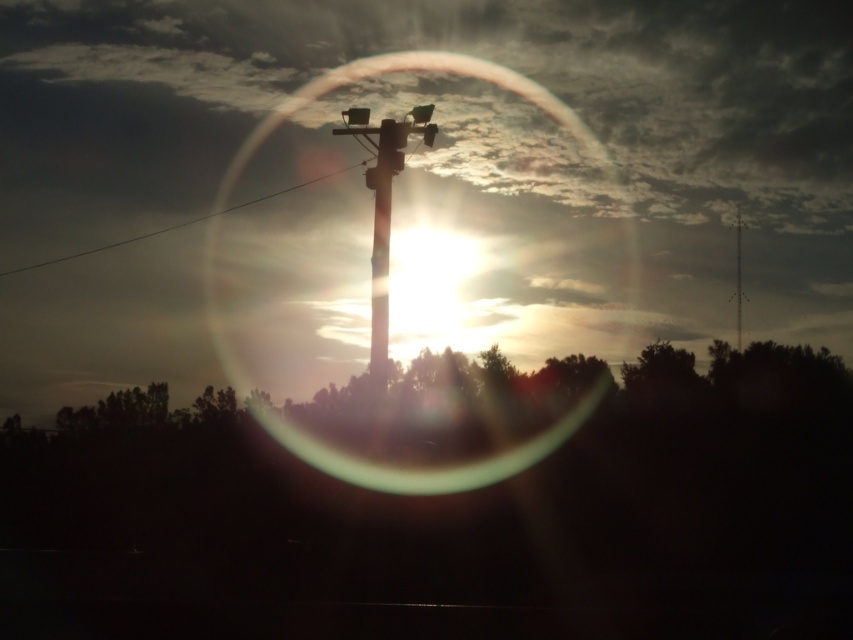
Between smooth wood telegraph pole at center and smooth wood telegraph pole at upper center, which one has more height?

Standing taller between the two is smooth wood telegraph pole at center.

Identify the location of smooth wood telegraph pole at center. The image size is (853, 640). (384, 212).

What are the coordinates of `smooth wood telegraph pole at center` in the screenshot? It's located at (384, 212).

Does transparent glass bubble at center have a lesser width compared to smooth wood telegraph pole at upper center?

Incorrect, transparent glass bubble at center's width is not less than smooth wood telegraph pole at upper center's.

Describe the element at coordinates (444, 72) in the screenshot. I see `transparent glass bubble at center` at that location.

The height and width of the screenshot is (640, 853). What do you see at coordinates (444, 72) in the screenshot? I see `transparent glass bubble at center` at bounding box center [444, 72].

This screenshot has width=853, height=640. Identify the location of transparent glass bubble at center. (x=444, y=72).

Does transparent glass bubble at center appear on the left side of black wire at upper left?

No, transparent glass bubble at center is not to the left of black wire at upper left.

Consider the image. Is transparent glass bubble at center to the right of black wire at upper left from the viewer's perspective?

Correct, you'll find transparent glass bubble at center to the right of black wire at upper left.

What do you see at coordinates (444, 72) in the screenshot? The width and height of the screenshot is (853, 640). I see `transparent glass bubble at center` at bounding box center [444, 72].

The height and width of the screenshot is (640, 853). I want to click on transparent glass bubble at center, so click(444, 72).